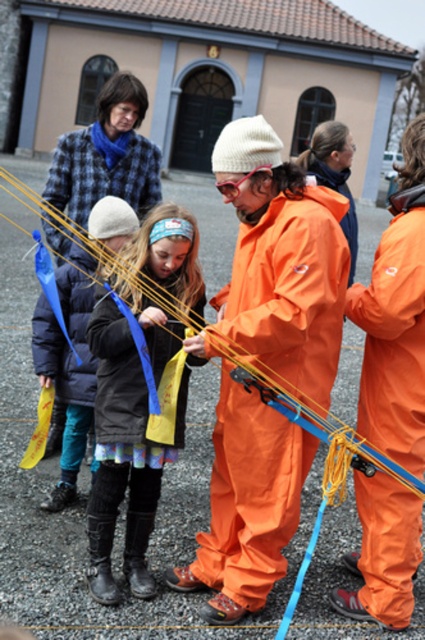
You are standing at the origin point in the image. Which direction should you move to reach the orange waterproof jumpsuit at center?

The orange waterproof jumpsuit at center is located at point 0.569 on the x axis and 0.626 on the y axis. Since you are at the origin, you should move right along the x axis and up along the y axis to reach it.

You are a photographer trying to capture a clear photo of the orange waterproof suit at center. There is an orange waterproof jumpsuit at center blocking your view. Which direction should you move to avoid the obstruction?

Move to the left to avoid the orange waterproof jumpsuit at center, which is to the right of the orange waterproof suit at center.

You are standing at the entrance of the building and want to find the fluffy woolen hat at center. According to the coordinates provided, in which direction should you look to locate it?

The fluffy woolen hat at center is located at coordinates point (x=124, y=456). Based on standard coordinate systems, this places it towards the lower right area of the image from your perspective at the entrance. Look towards the lower right direction to find it.